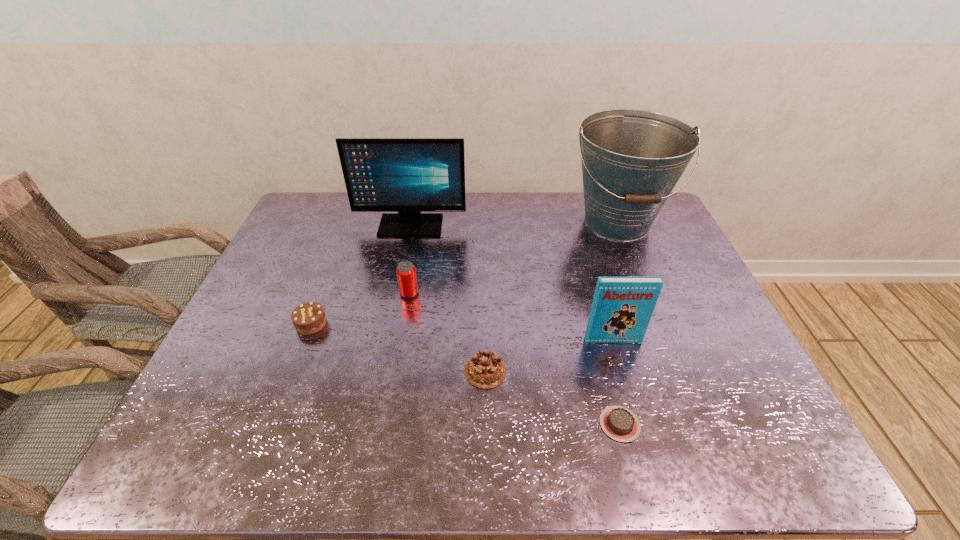
Image resolution: width=960 pixels, height=540 pixels. Find the location of `free space at the near left corner of the desktop`. free space at the near left corner of the desktop is located at coordinates (163, 454).

In order to click on free point between the bucket and the fourth tallest object in this screenshot , I will do `click(513, 258)`.

You are a GUI agent. You are given a task and a screenshot of the screen. Output one action in this format:
    pyautogui.click(x=<x>, y=<y>)
    Task: Click on the vacant region between the bucket and the sixth farthest object
    The image size is (960, 540).
    Given the screenshot: What is the action you would take?
    pyautogui.click(x=551, y=296)

Find the location of a particular element. The image size is (960, 540). free space between the shortest object and the monitor is located at coordinates (516, 325).

Find the location of a particular element. The image size is (960, 540). unoccupied position between the third shortest object and the fourth object from right to left is located at coordinates (398, 347).

Identify the location of free space between the monitor and the fourth nearest object. This screenshot has width=960, height=540. (361, 275).

Locate an element on the screen. The height and width of the screenshot is (540, 960). free space that is in between the monitor and the third farthest object is located at coordinates (410, 260).

In order to click on empty space between the bucket and the second shortest object in this screenshot , I will do `click(551, 296)`.

Where is `vacant point located between the bucket and the monitor`? The height and width of the screenshot is (540, 960). vacant point located between the bucket and the monitor is located at coordinates (514, 224).

In order to click on free space between the bucket and the third farthest object in this screenshot , I will do `click(513, 258)`.